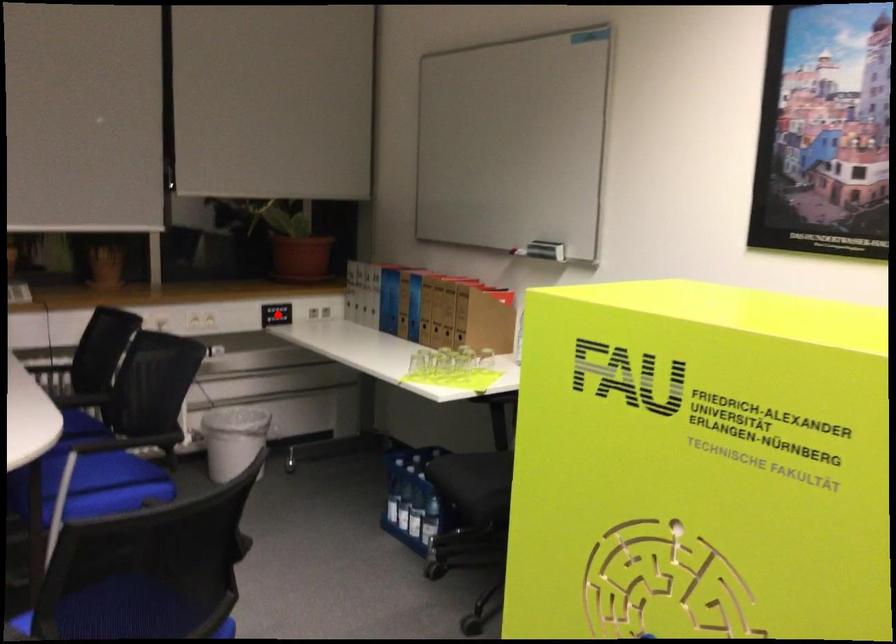
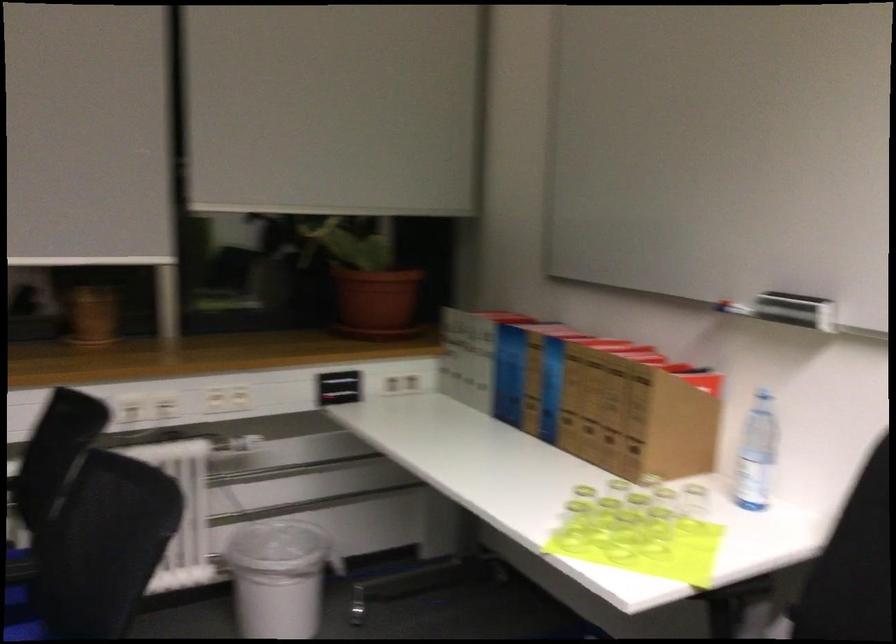
The point at the highlighted location is marked in the first image. Where is the corresponding point in the second image?

(339, 386)